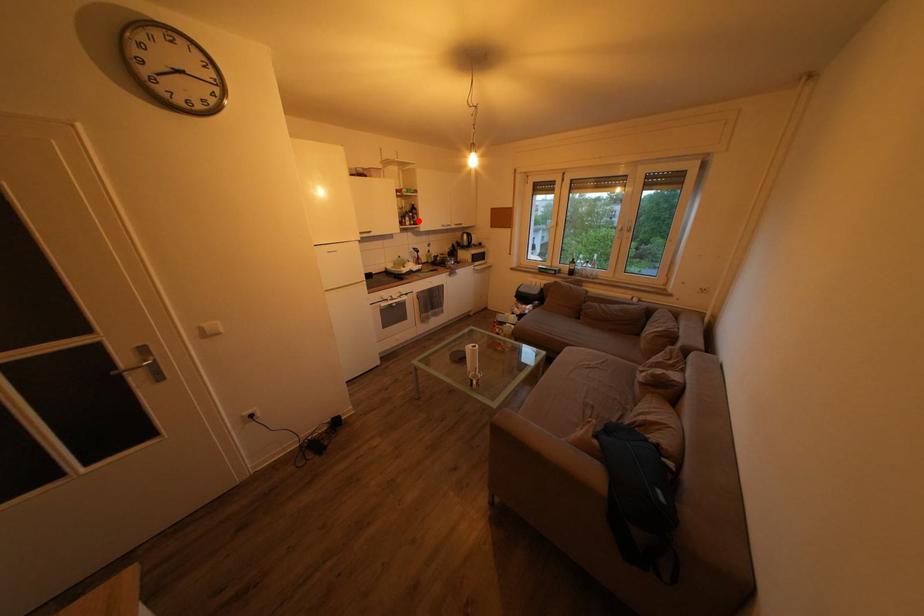
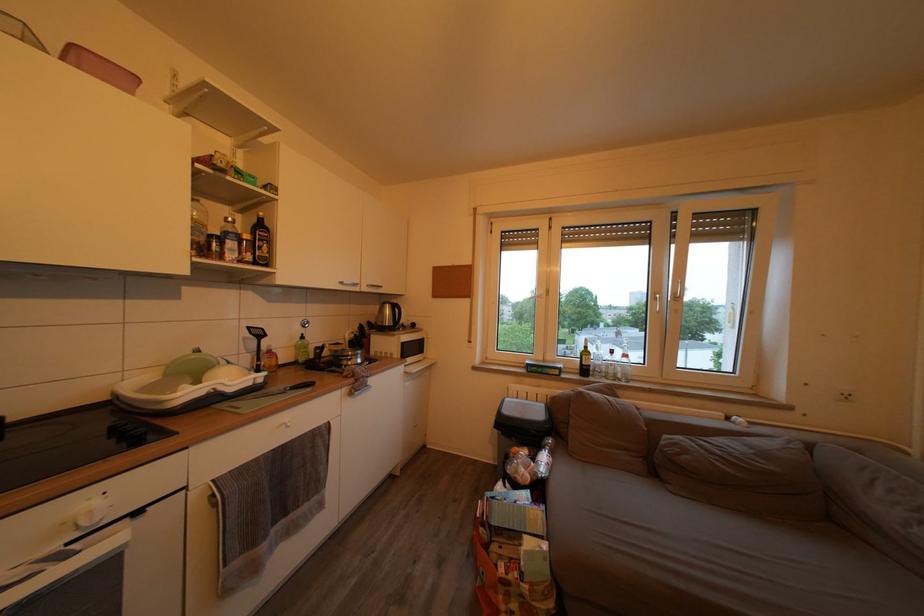
Where in the second image is the point corresponding to the highlighted location from the first image?

(253, 243)